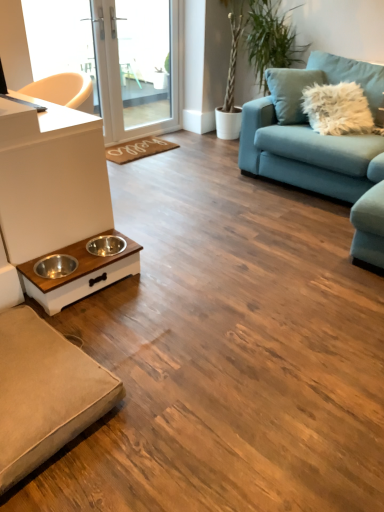
Question: From the image's perspective, is white matte counter top at left under white wood pet feeder at lower left?

Choices:
 (A) yes
 (B) no

Answer: (B)

Question: Is white matte counter top at left positioned with its back to white wood pet feeder at lower left?

Choices:
 (A) yes
 (B) no

Answer: (B)

Question: Is white matte counter top at left closer to the viewer compared to white wood pet feeder at lower left?

Choices:
 (A) no
 (B) yes

Answer: (B)

Question: Is white matte counter top at left outside of white wood pet feeder at lower left?

Choices:
 (A) no
 (B) yes

Answer: (B)

Question: Is white wood pet feeder at lower left located within white matte counter top at left?

Choices:
 (A) yes
 (B) no

Answer: (B)

Question: Considering the positions of point (289, 89) and point (16, 351), is point (289, 89) closer or farther from the camera than point (16, 351)?

Choices:
 (A) farther
 (B) closer

Answer: (A)

Question: From a real-world perspective, relative to beige fabric studio couch at lower left, which appears as the 1th studio couch when viewed from the front, is teal fabric couch at upper right, the first studio couch from the top, vertically above or below?

Choices:
 (A) below
 (B) above

Answer: (B)

Question: Considering the relative positions of teal fabric couch at upper right, placed as the 2th studio couch when sorted from front to back, and beige fabric studio couch at lower left, marked as the first studio couch in a left-to-right arrangement, in the image provided, is teal fabric couch at upper right, placed as the 2th studio couch when sorted from front to back, to the left or to the right of beige fabric studio couch at lower left, marked as the first studio couch in a left-to-right arrangement,?

Choices:
 (A) left
 (B) right

Answer: (B)

Question: Considering the positions of teal fabric couch at upper right, the first studio couch from the top, and beige fabric studio couch at lower left, which is the first studio couch in bottom-to-top order, in the image, is teal fabric couch at upper right, the first studio couch from the top, bigger or smaller than beige fabric studio couch at lower left, which is the first studio couch in bottom-to-top order,?

Choices:
 (A) big
 (B) small

Answer: (A)

Question: Is point coord(59,202) closer or farther from the camera than point coord(273,64)?

Choices:
 (A) closer
 (B) farther

Answer: (A)

Question: From their relative heights in the image, would you say white matte counter top at left is taller or shorter than green leafy plant at upper right?

Choices:
 (A) tall
 (B) short

Answer: (B)

Question: Relative to green leafy plant at upper right, is white matte counter top at left in front or behind?

Choices:
 (A) front
 (B) behind

Answer: (A)

Question: Is white matte counter top at left situated inside green leafy plant at upper right or outside?

Choices:
 (A) outside
 (B) inside

Answer: (A)

Question: In terms of height, does white matte counter top at left look taller or shorter compared to teal fabric couch at upper right, the first studio couch from the top?

Choices:
 (A) short
 (B) tall

Answer: (A)

Question: Is white matte counter top at left in front of or behind teal fabric couch at upper right, the first studio couch from the top, in the image?

Choices:
 (A) behind
 (B) front

Answer: (B)